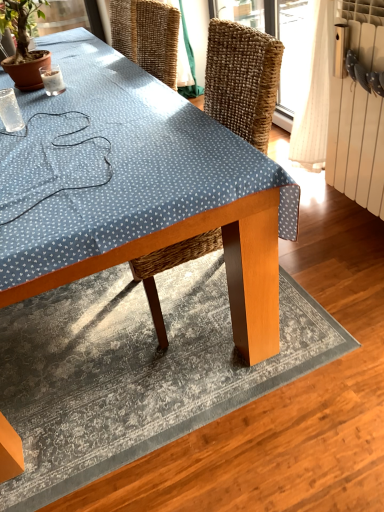
Where is `vacant region in front of clear glass coffee cup at upper left, which is counted as the second coffee cup, starting from the bottom`? This screenshot has height=512, width=384. vacant region in front of clear glass coffee cup at upper left, which is counted as the second coffee cup, starting from the bottom is located at coordinates (54, 106).